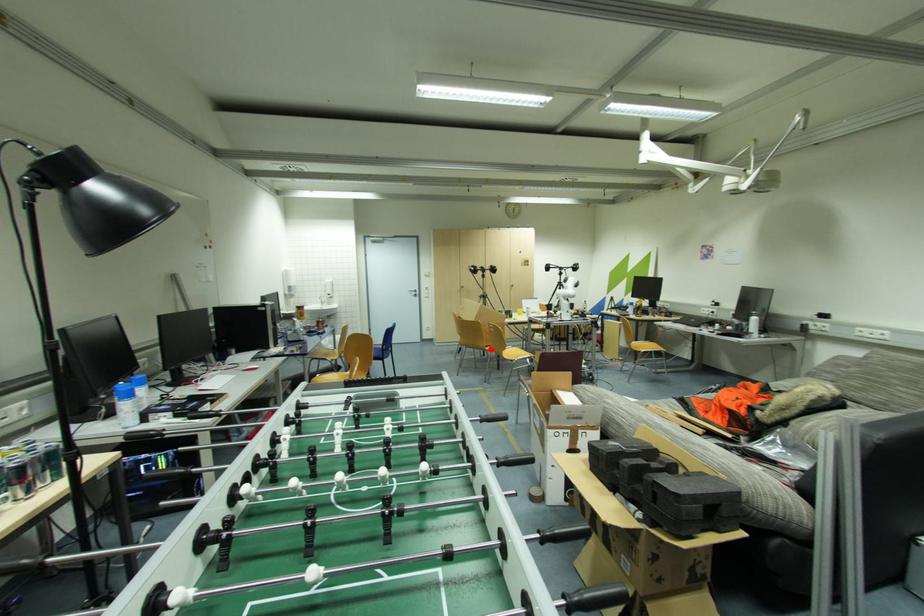
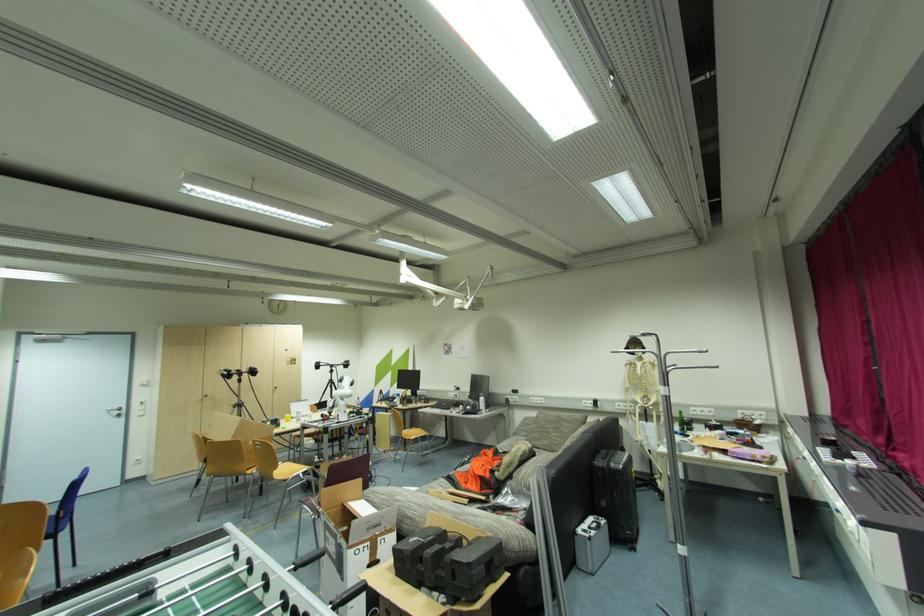
Question: I am providing you with two images of the same scene from different viewpoints. Given a red point in image1, look at the same physical point in image2. Is it:

Choices:
 (A) Closer to the viewpoint
 (B) Farther from the viewpoint

Answer: (A)